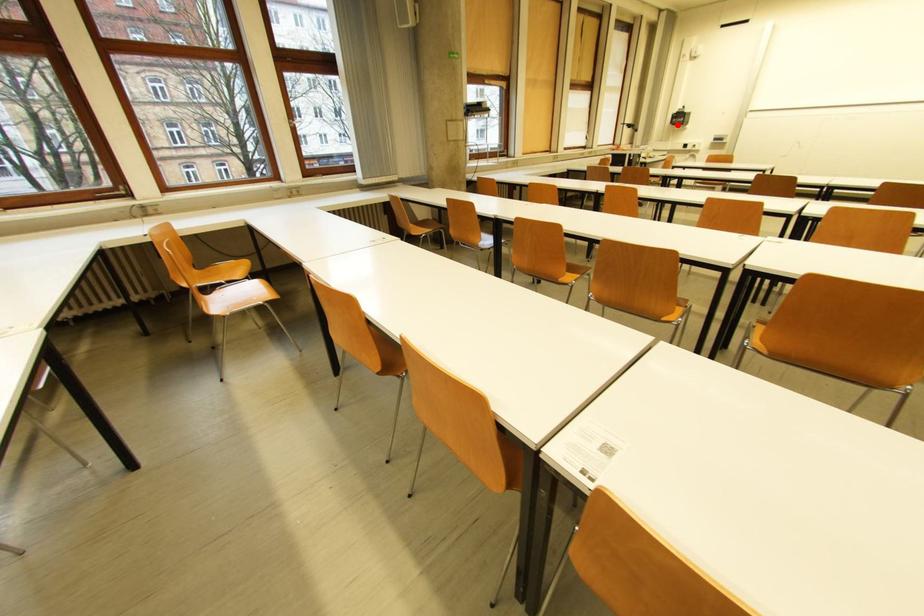
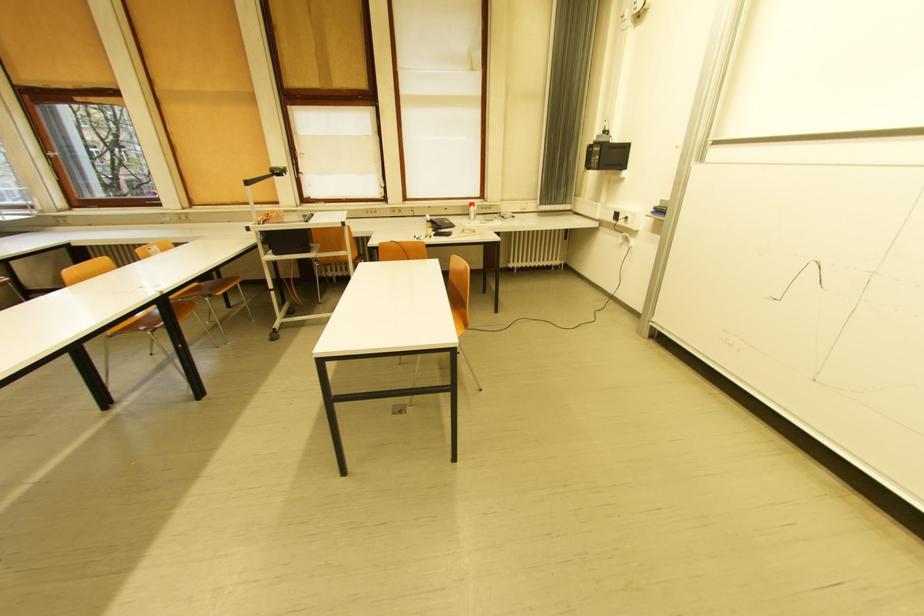
Where in the second image is the point corresponding to the highlighted location from the first image?

(592, 168)